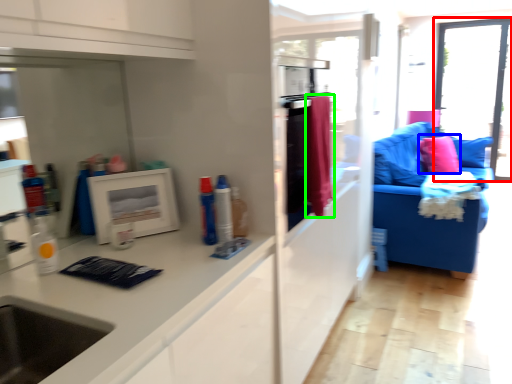
Question: Based on their relative distances, which object is nearer to window (highlighted by a red box)? Choose from pillow (highlighted by a blue box) and material (highlighted by a green box).

Choices:
 (A) pillow
 (B) material

Answer: (A)